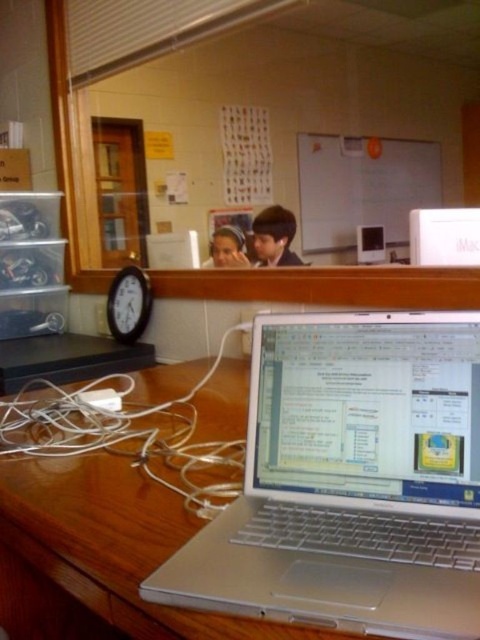
You are a student trying to decide which device to use for a presentation. The silver metallic laptop at center and the silver metallic imac at center are both available. Based on their sizes, which one might have a larger screen for better visibility?

The silver metallic laptop at center is much taller than the silver metallic imac at center, so it likely has a larger screen for better visibility.

You are organizing the desk and need to place a new document organizer between the silver metallic laptop at center and the wooden clock at left. Based on their positions, which object should the organizer be placed closer to?

The document organizer should be placed closer to the wooden clock at left because the silver metallic laptop at center is positioned on the right side of the wooden clock at left, meaning the clock is on the left side of the laptop. Therefore, placing the organizer closer to the clock would maintain the existing spatial arrangement.

You are organizing the desk and need to move the wooden clock at left closer to the silver metallic laptop at center. Based on their current positions, which object is closer to you as you face the desk?

The silver metallic laptop at center is closer to you because it is in front of the wooden clock at left.